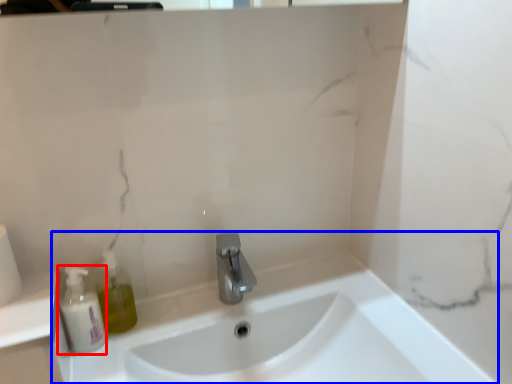
Question: Which of the following is the closest to the observer, mouthwash (highlighted by a red box) or sink (highlighted by a blue box)?

Choices:
 (A) mouthwash
 (B) sink

Answer: (B)